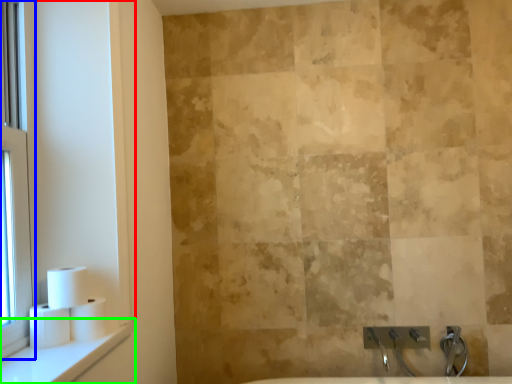
Question: Which object is the farthest from window frame (highlighted by a red box)? Choose among these: window (highlighted by a blue box) or window sill (highlighted by a green box).

Choices:
 (A) window
 (B) window sill

Answer: (B)